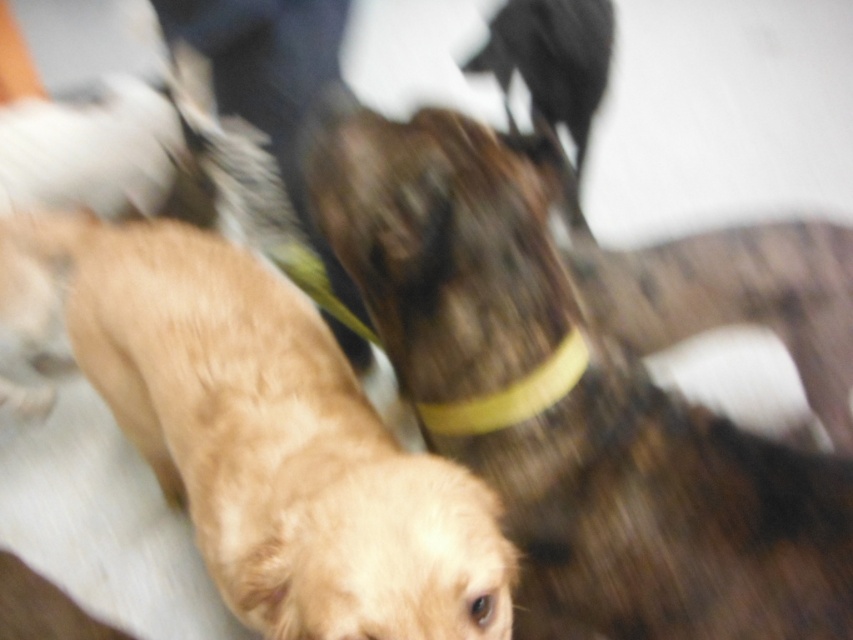
You are a photographer trying to capture a clear shot of the brown fuzzy dog at center and the yellow rubber neckband at center. Since the image is motion blurred, which object would appear more in focus in the photo?

The brown fuzzy dog at center is in front of the yellow rubber neckband at center, so it would appear more in focus in the photo.

You are a photographer trying to capture a clear shot of the dogs in the image. You notice two points of interest labeled as point (651, 576) and point (321, 388). Which point is closer to your camera lens?

Point (651, 576) is closer to the camera lens than point (321, 388).

You are standing in the indoor space where the dogs are. There are two points marked as point [416,237] and point [508,388]. Which point is closer to you?

Point [416,237] is in front of point [508,388], so it is closer to you.